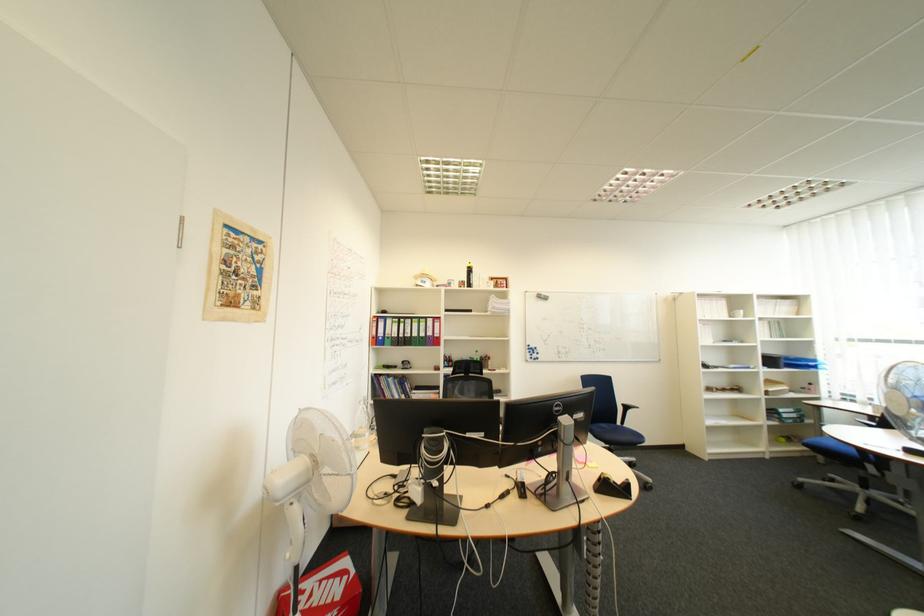
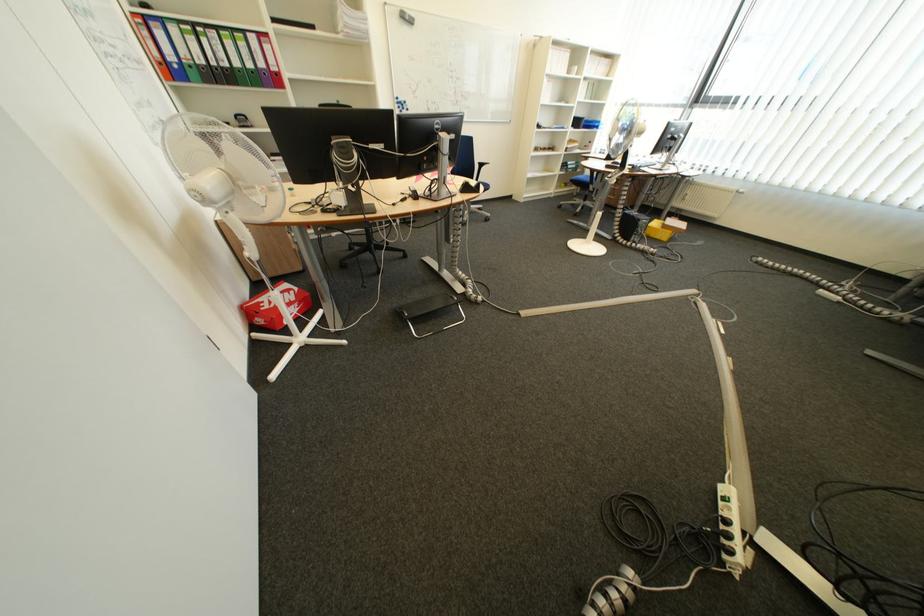
First-person continuous shooting, in which direction is the camera rotating?

The camera's rotation is toward right-down.